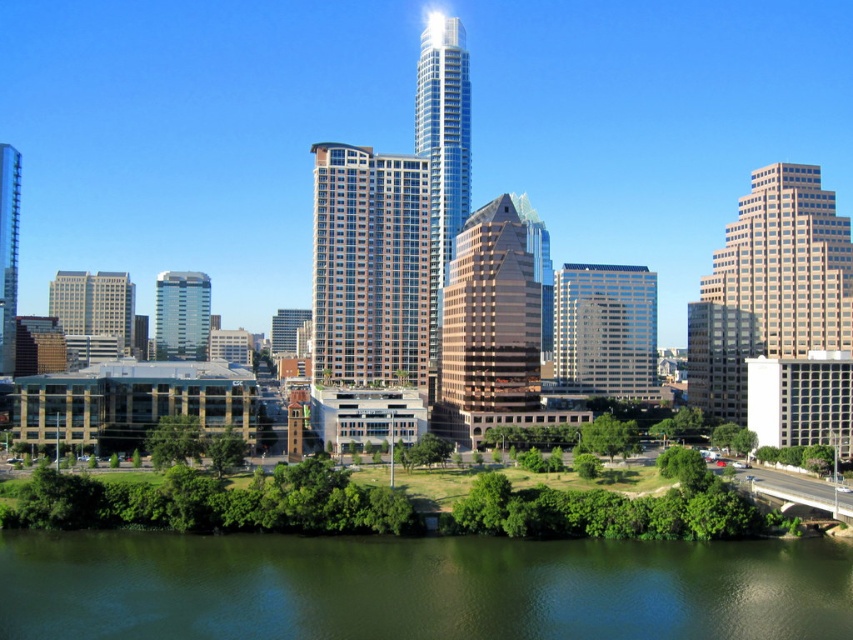
You are a drone operator trying to capture aerial footage of the city. You need to fly your drone between the white glass building at center and the shiny glass skyscraper at center. Which building should you position your drone in front of to ensure it stays visible in the shot?

You should position your drone in front of the white glass building at center because the shiny glass skyscraper at center is behind it, so keeping the drone in front of the white glass building will keep it visible.